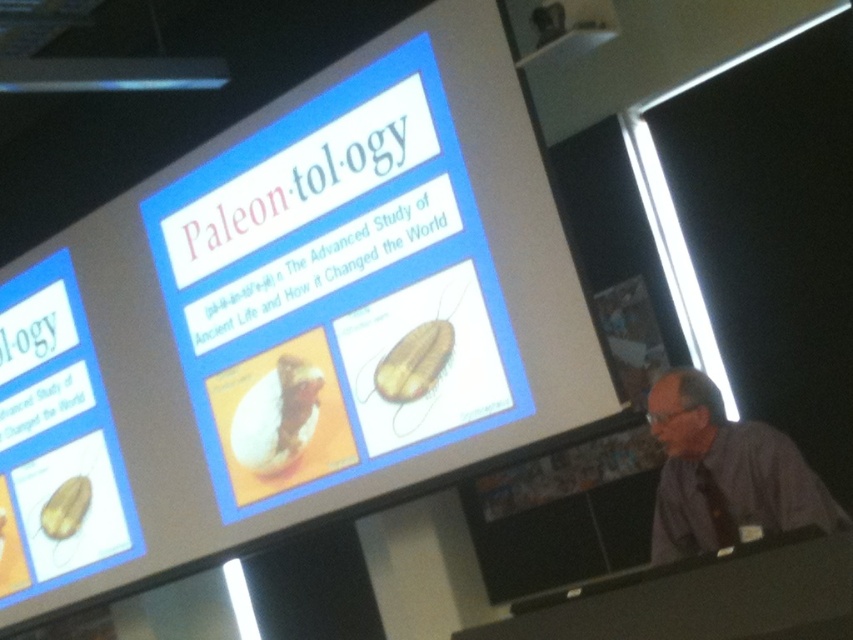
You are an attendee at the lecture. You want to see both the blue matte sign at center and the purple shirt at lower right. Can you see both objects clearly at the same time?

The purple shirt at lower right is behind the blue matte sign at center, so you cannot see both objects clearly at the same time.

You are a student sitting in the front row of the lecture hall. You see two points on the slide projection. The first point is at position point (250, 333) and the second is at point (654, 420). Which point appears closer to you?

Point (250, 333) is further to the camera than point (654, 420). Therefore, point (654, 420) appears closer to you.

You are a student sitting in the front row of the lecture hall. You need to hand a note to your friend who is sitting next to the purple shirt at lower right without leaving your seat. The note is on the blue matte sign at center. Can you reach them by stretching your arm? Explain.

The blue matte sign at center and purple shirt at lower right are 1.20 meters apart. Since the average human arm span is about 1.5 meters, you can likely reach your friend by stretching your arm.